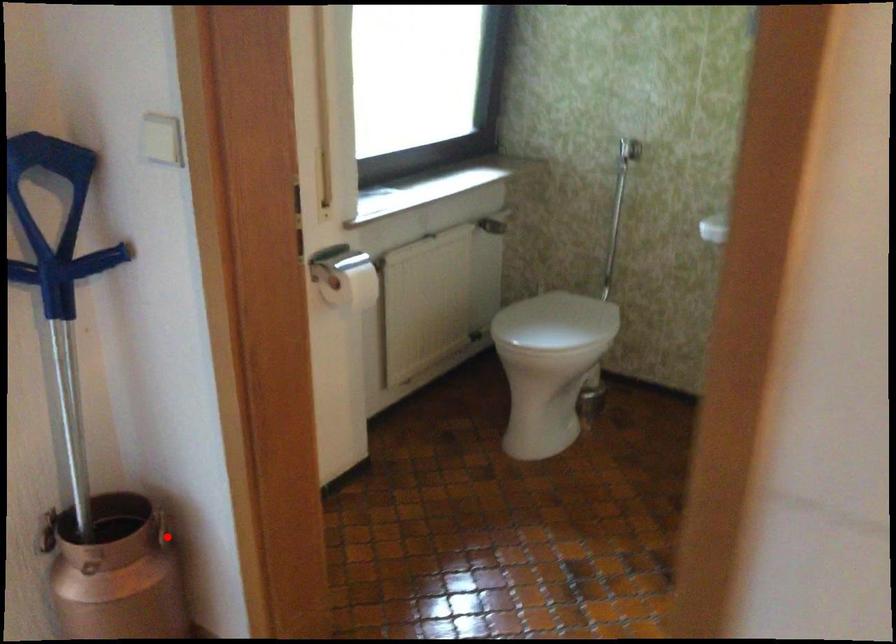
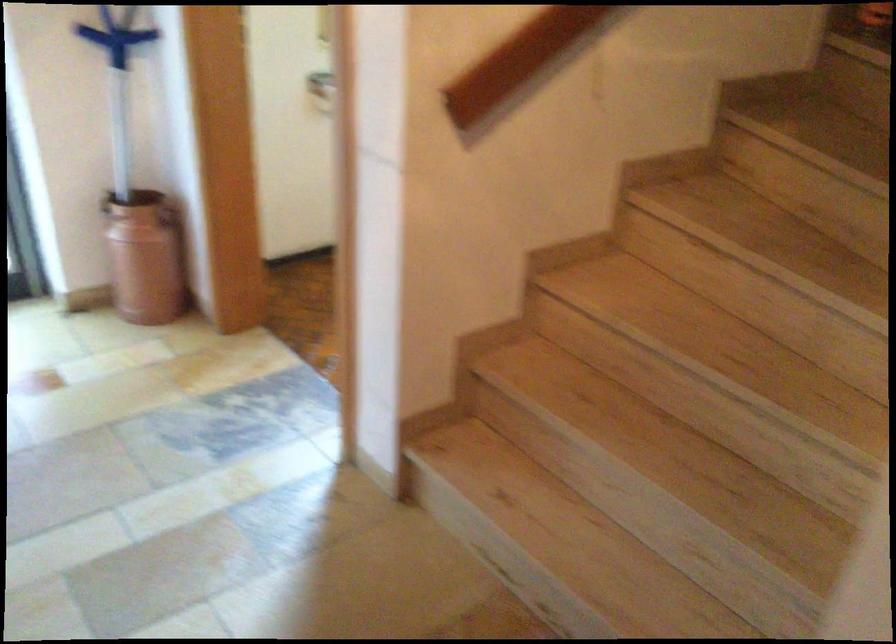
Question: A red point is marked in image1. In image2, is the corresponding 3D point closer to the camera or farther? Reply with the corresponding letter.

Choices:
 (A) The corresponding 3D point is closer.
 (B) The corresponding 3D point is farther.

Answer: (B)